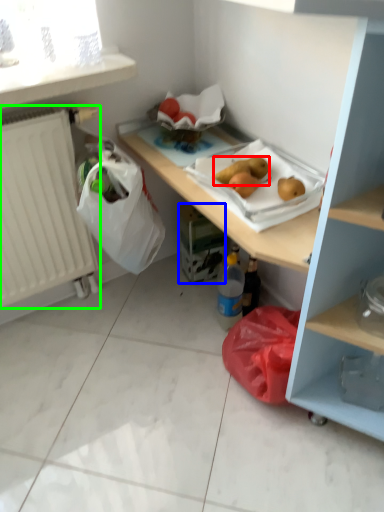
Question: Considering the real-world distances, which object is closest to food (highlighted by a red box)? carton (highlighted by a blue box) or radiator (highlighted by a green box).

Choices:
 (A) carton
 (B) radiator

Answer: (A)